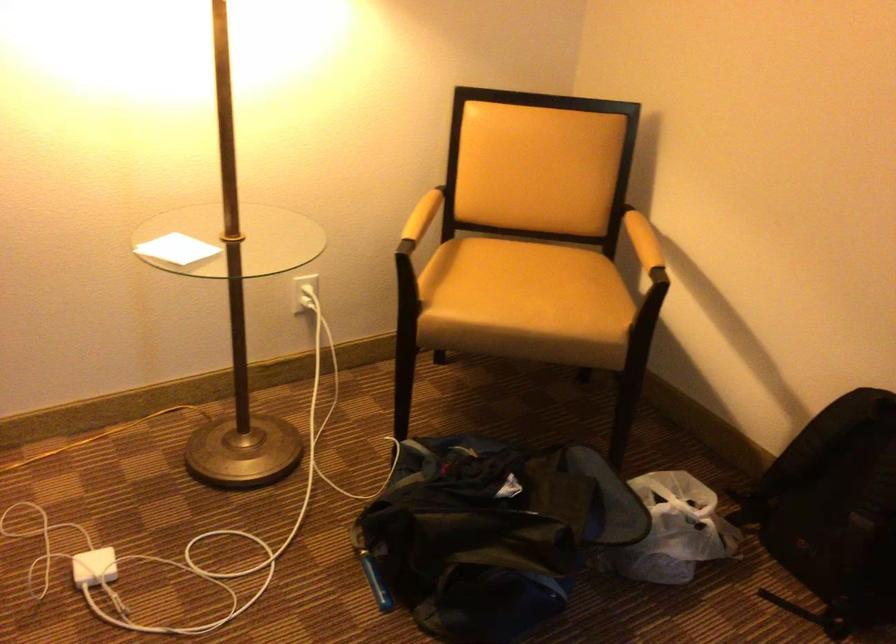
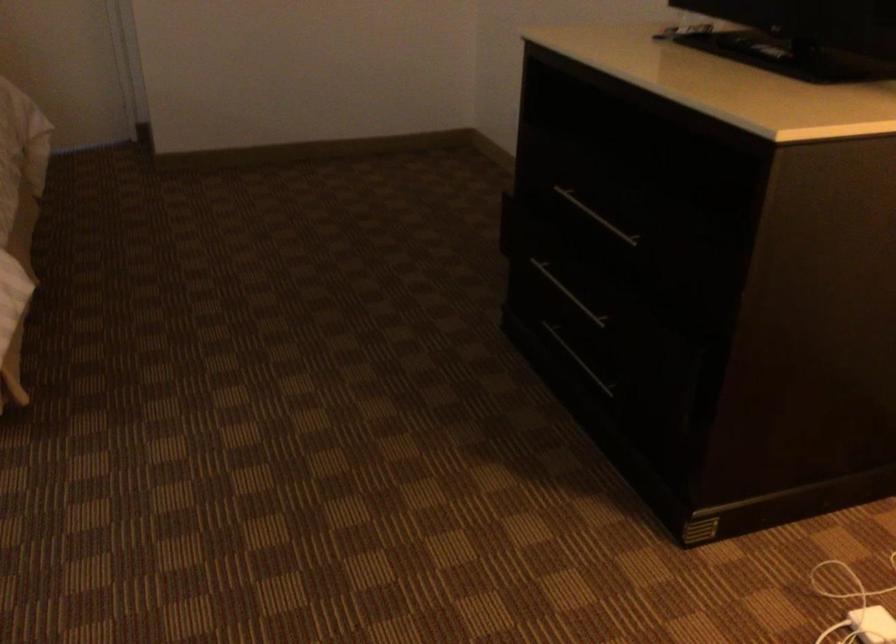
From the picture: The first image is from the beginning of the video and the second image is from the end. How did the camera likely rotate when shooting the video?

The camera's rotation is toward left-down.